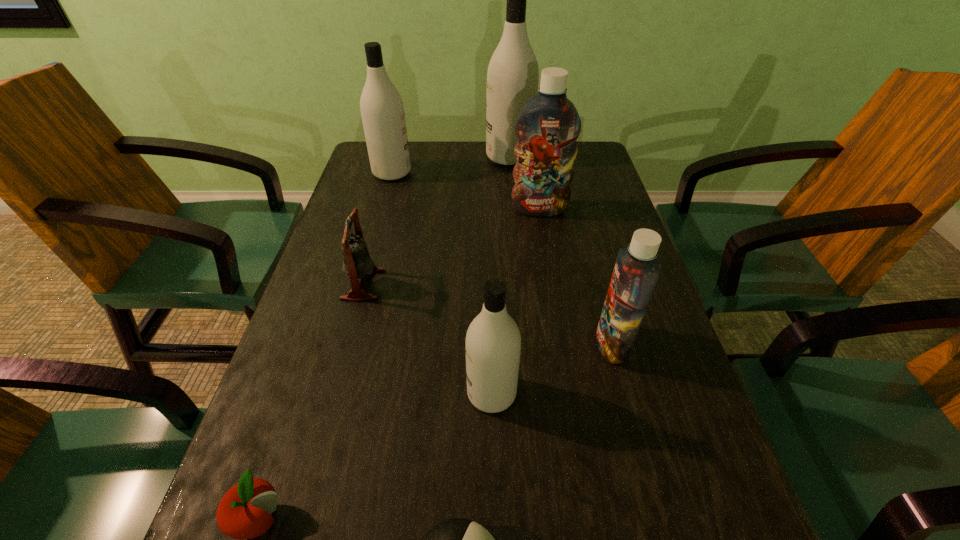
The height and width of the screenshot is (540, 960). What are the coordinates of `the third closest white shampoo to the third nearest shampoo` in the screenshot? It's located at (493, 342).

Identify which white shampoo is the closest to the bigger blue shampoo. Please provide its 2D coordinates. Your answer should be formatted as a tuple, i.e. [(x, y)], where the tuple contains the x and y coordinates of a point satisfying the conditions above.

[(513, 74)]